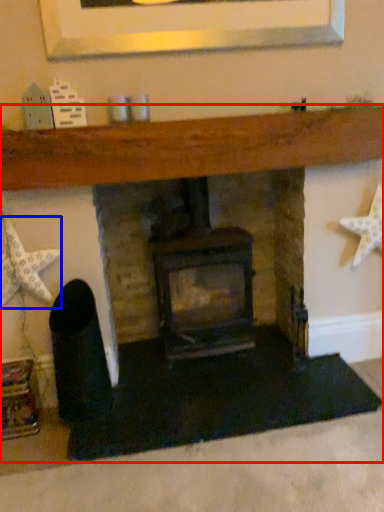
Question: Which object appears farthest to the camera in this image, fireplace (highlighted by a red box) or starfish (highlighted by a blue box)?

Choices:
 (A) fireplace
 (B) starfish

Answer: (B)